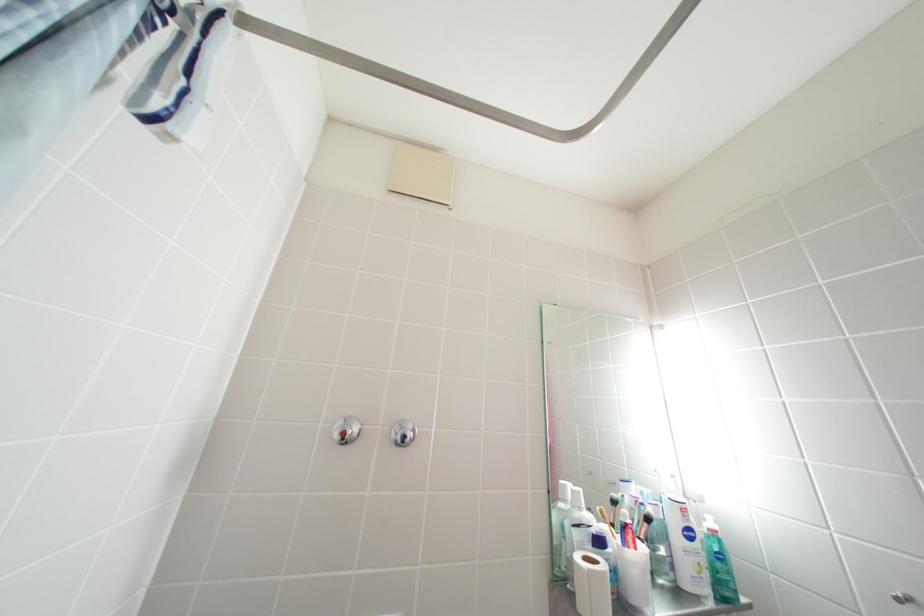
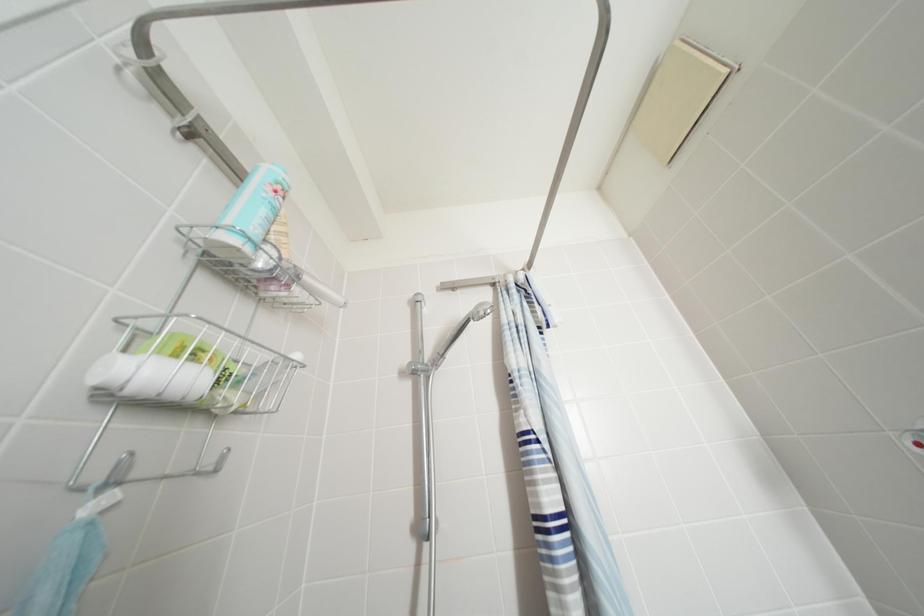
The first image is from the beginning of the video and the second image is from the end. How did the camera likely rotate when shooting the video?

The camera's rotation is toward left-up.